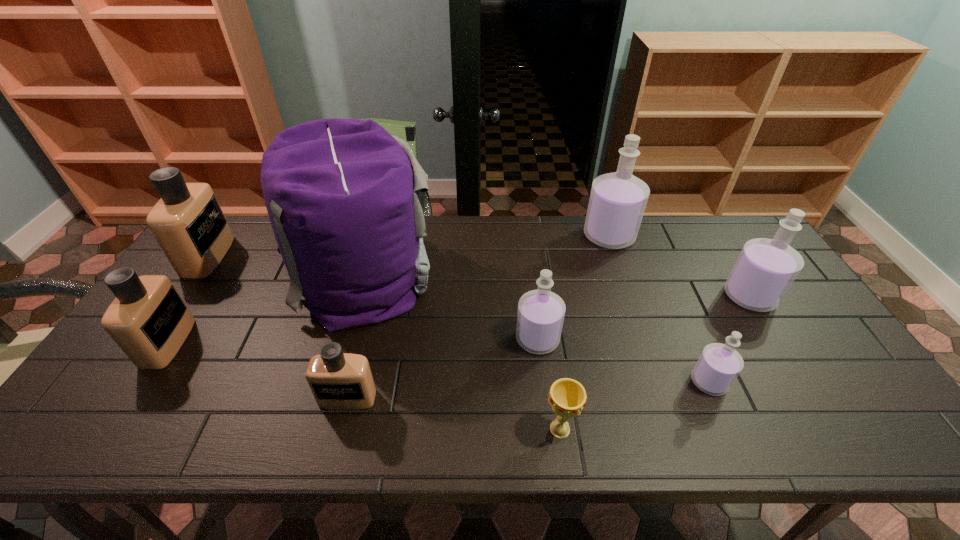
Where is `vacant area at the near edge of the desktop`? This screenshot has width=960, height=540. vacant area at the near edge of the desktop is located at coordinates (811, 418).

In the image, there is a desktop. Identify the location of vacant region at the far left corner. This screenshot has width=960, height=540. (240, 245).

Where is `vacant space that's between the second smallest purple perfume and the rightmost beige perfume`? Image resolution: width=960 pixels, height=540 pixels. vacant space that's between the second smallest purple perfume and the rightmost beige perfume is located at coordinates 443,368.

Image resolution: width=960 pixels, height=540 pixels. In order to click on free space between the second farthest beige perfume and the biggest beige perfume in this screenshot , I will do `click(188, 299)`.

Find the location of `free space between the farthest beige perfume and the smallest purple perfume`. free space between the farthest beige perfume and the smallest purple perfume is located at coordinates (459, 319).

Identify the location of free space between the smallest purple perfume and the biggest beige perfume. The width and height of the screenshot is (960, 540). (459, 319).

Identify the location of free space between the nearest object and the backpack. tap(460, 352).

Locate an element on the screen. The width and height of the screenshot is (960, 540). free spot between the leftmost purple perfume and the rightmost object is located at coordinates (643, 318).

At what (x,y) coordinates should I click in order to perform the action: click on free space between the farthest beige perfume and the fifth perfume from right to left. Please return your answer as a coordinate pair (x, y). Looking at the image, I should click on (277, 327).

Locate an element on the screen. This screenshot has height=540, width=960. free spot between the rightmost perfume and the second nearest purple perfume is located at coordinates (643, 318).